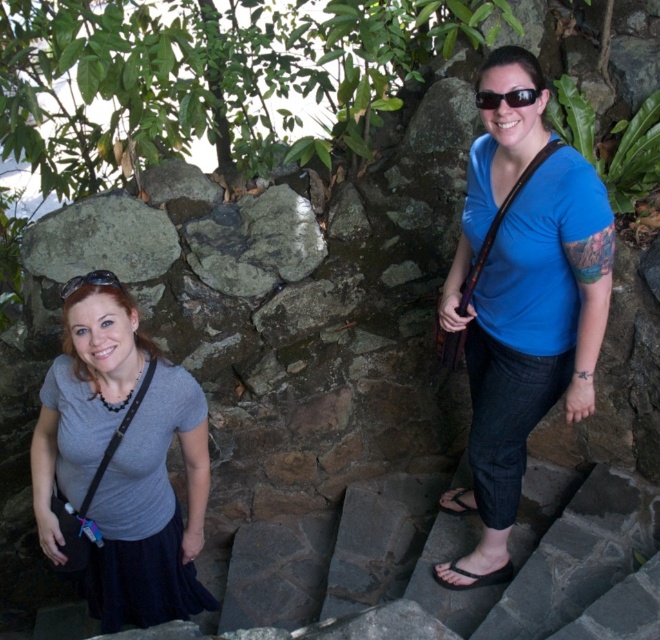
Between point (69, 284) and point (475, 509), which one is positioned in front?

Positioned in front is point (69, 284).

Is point (69, 285) farther from viewer compared to point (467, 515)?

No.

Which is behind, point (100, 276) or point (467, 508)?

Point (467, 508)

The image size is (660, 640). I want to click on clear plastic goggles at upper left, so click(x=90, y=282).

Does black rubber sandal at lower right appear on the right side of black flip-flop at lower center?

Incorrect, black rubber sandal at lower right is not on the right side of black flip-flop at lower center.

Is black rubber sandal at lower right thinner than black flip-flop at lower center?

In fact, black rubber sandal at lower right might be wider than black flip-flop at lower center.

Locate an element on the screen. The width and height of the screenshot is (660, 640). black rubber sandal at lower right is located at coordinates (473, 577).

The height and width of the screenshot is (640, 660). Find the location of `black rubber sandal at lower right`. black rubber sandal at lower right is located at coordinates (473, 577).

In the scene shown: Can you confirm if sunglasses at upper right is positioned above clear plastic goggles at upper left?

Yes.

The height and width of the screenshot is (640, 660). I want to click on sunglasses at upper right, so click(506, 99).